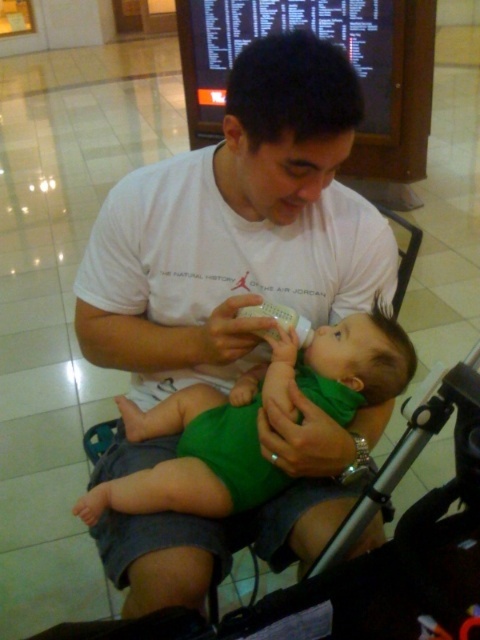
Question: In this image, where is white cotton shirt at center located relative to clear plastic bottle at center?

Choices:
 (A) below
 (B) above

Answer: (A)

Question: Among these objects, which one is nearest to the camera?

Choices:
 (A) clear plastic bottle at center
 (B) white cotton shirt at center
 (C) green fabric baby at center

Answer: (B)

Question: Is white cotton shirt at center below clear plastic bottle at center?

Choices:
 (A) no
 (B) yes

Answer: (B)

Question: Estimate the real-world distances between objects in this image. Which object is farther from the clear plastic bottle at center?

Choices:
 (A) white cotton shirt at center
 (B) green fabric baby at center

Answer: (A)

Question: Does white cotton shirt at center appear on the left side of clear plastic bottle at center?

Choices:
 (A) no
 (B) yes

Answer: (B)

Question: Which object is the farthest from the white cotton shirt at center?

Choices:
 (A) clear plastic bottle at center
 (B) green fabric baby at center

Answer: (A)